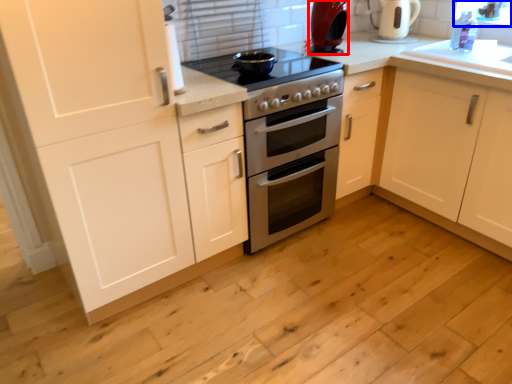
Question: Which point is closer to the camera, kitchen appliance (highlighted by a red box) or window screen (highlighted by a blue box)?

Choices:
 (A) kitchen appliance
 (B) window screen

Answer: (A)